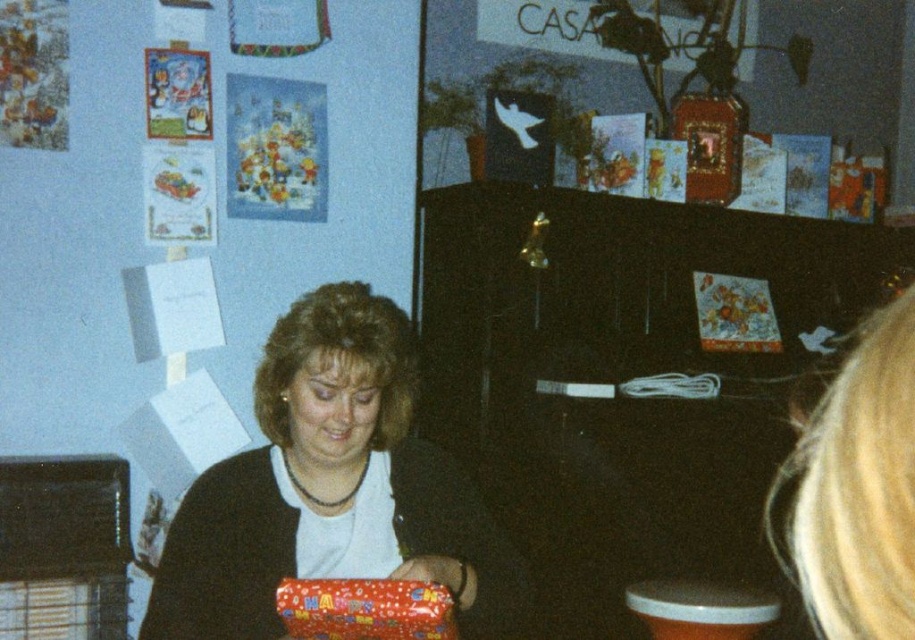
Which of these two, shiny red wrapping paper at center or shiny red wrapping paper at lower center, stands shorter?

With less height is shiny red wrapping paper at lower center.

Measure the distance between point (357, 353) and camera.

Point (357, 353) and camera are 1.43 meters apart.

You are a GUI agent. You are given a task and a screenshot of the screen. Output one action in this format:
    pyautogui.click(x=<x>, y=<y>)
    Task: Click on the shiny red wrapping paper at center
    
    Given the screenshot: What is the action you would take?
    pyautogui.click(x=331, y=488)

Who is taller, shiny red wrapping paper at center or orange plastic stool at lower right?

shiny red wrapping paper at center

Describe the element at coordinates (331, 488) in the screenshot. I see `shiny red wrapping paper at center` at that location.

The image size is (915, 640). I want to click on shiny red wrapping paper at center, so click(331, 488).

Which is above, blonde hair at lower right or orange plastic stool at lower right?

blonde hair at lower right is higher up.

Does blonde hair at lower right appear over orange plastic stool at lower right?

Correct, blonde hair at lower right is located above orange plastic stool at lower right.

I want to click on blonde hair at lower right, so click(x=856, y=490).